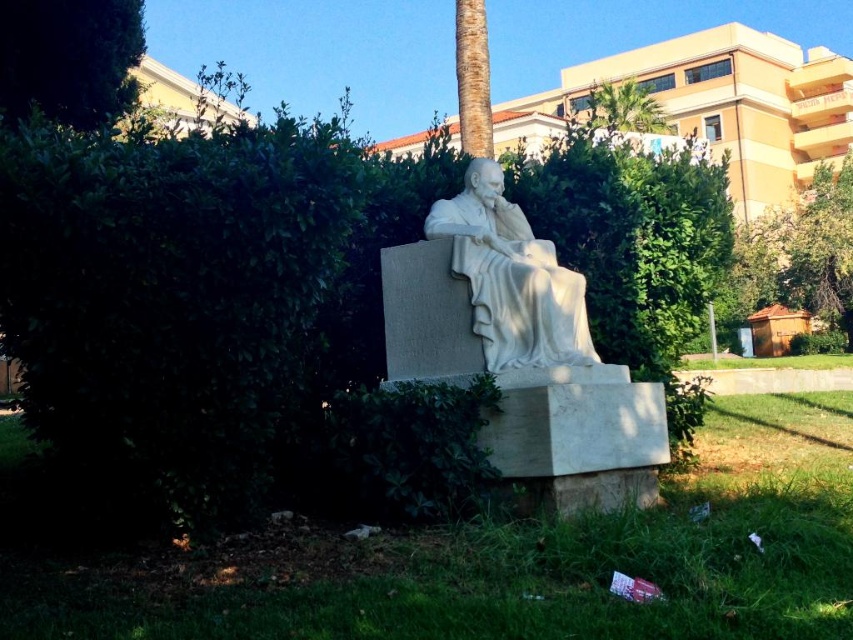
You are standing in front of the marble statue and looking towards the green leafy tree at upper left and the brown textured palm tree at upper center. Which tree is closer to you?

The green leafy tree at upper left is closer to you because it is positioned further to the viewer than the brown textured palm tree at upper center.

You are a bird flying over the serene outdoor setting. You want to land on the highest point between the green leafy tree at upper right and the brown textured palm tree at upper center. Which tree should you choose?

The brown textured palm tree at upper center is higher than the green leafy tree at upper right, so you should land on the brown textured palm tree at upper center.

You are standing in front of the marble statue and want to take a photo of the green leafy tree at upper right. Based on its position, which direction should you face to capture it in your shot?

The green leafy tree at upper right is located at point (802, 252), so to capture it in your photo, you should face towards the upper right direction from the statue.